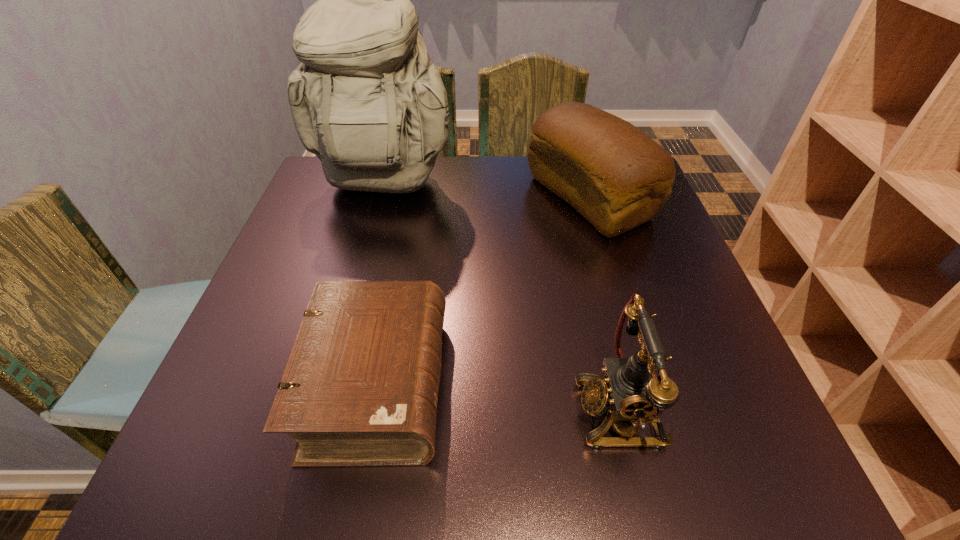
This screenshot has width=960, height=540. In order to click on backpack that is at the far edge in this screenshot , I will do `click(367, 100)`.

What are the coordinates of `bread at the far edge` in the screenshot? It's located at (614, 175).

Where is `telephone present at the near edge`? The image size is (960, 540). telephone present at the near edge is located at coordinates (634, 392).

You are a GUI agent. You are given a task and a screenshot of the screen. Output one action in this format:
    pyautogui.click(x=<x>, y=<y>)
    Task: Click on the Bible that is positioned at the near edge
    
    Given the screenshot: What is the action you would take?
    pyautogui.click(x=360, y=388)

Where is `backpack that is positioned at the left edge`? The image size is (960, 540). backpack that is positioned at the left edge is located at coordinates (367, 100).

I want to click on Bible located at the left edge, so click(360, 388).

The width and height of the screenshot is (960, 540). In order to click on bread that is at the right edge in this screenshot , I will do `click(614, 175)`.

Where is `telephone at the right edge`? telephone at the right edge is located at coordinates (634, 392).

Where is `object present at the far left corner`? object present at the far left corner is located at coordinates (367, 100).

Identify the location of object present at the near left corner. (360, 388).